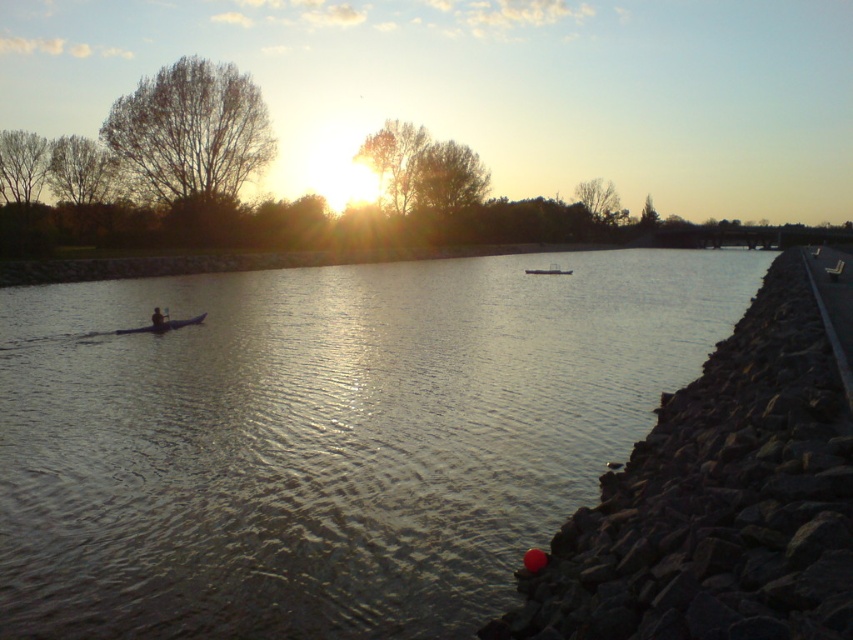
Question: Is the position of silvery reflective water at center more distant than that of matte black kayak at left?

Choices:
 (A) yes
 (B) no

Answer: (B)

Question: Can you confirm if matte black kayak at left is positioned to the left of metallic silver boat at center?

Choices:
 (A) no
 (B) yes

Answer: (B)

Question: Among these points, which one is nearest to the camera?

Choices:
 (A) (538, 273)
 (B) (641, 324)
 (C) (172, 326)

Answer: (C)

Question: Based on their relative distances, which object is farther from the smooth skin person at left?

Choices:
 (A) metallic silver boat at center
 (B) silvery reflective water at center

Answer: (A)

Question: Can you confirm if silvery reflective water at center is positioned to the left of matte black kayak at left?

Choices:
 (A) yes
 (B) no

Answer: (B)

Question: Among these points, which one is nearest to the camera?

Choices:
 (A) (357, 480)
 (B) (158, 312)
 (C) (537, 273)

Answer: (A)